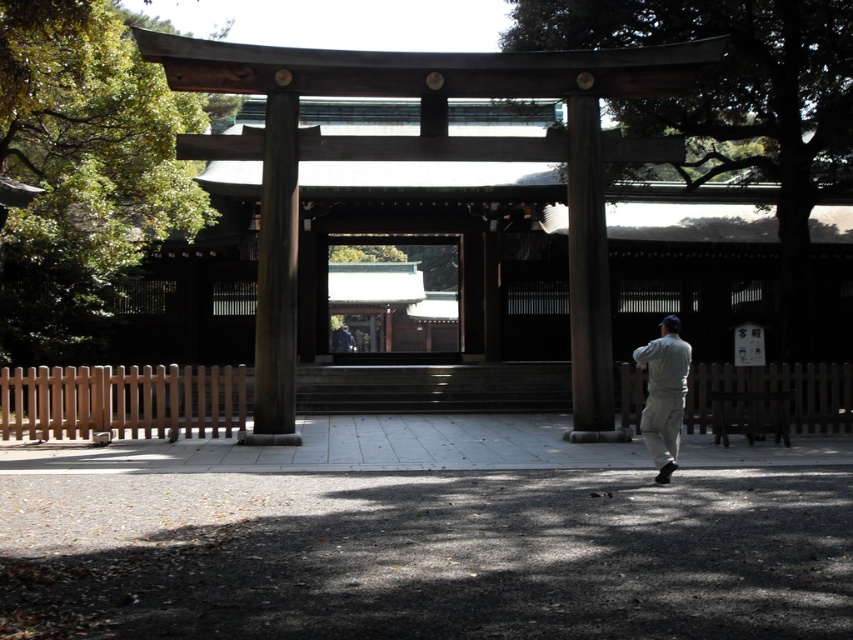
From the picture: You are standing in front of the torii gate and want to compare the widths of the objects in the scene. Which object is wider between the green tile roof at center and the gray fabric pants at right?

The green tile roof at center is wider than the gray fabric pants at right according to the description.